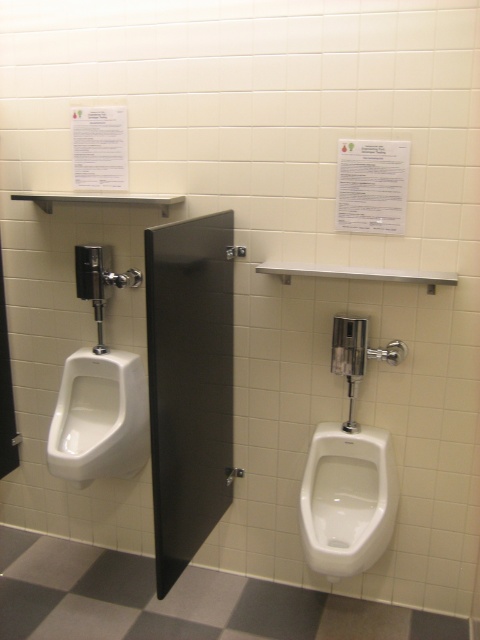
Which is more to the left, white glossy urinal at lower right or white glossy urinal at left?

From the viewer's perspective, white glossy urinal at left appears more on the left side.

Who is higher up, white glossy urinal at lower right or white glossy urinal at left?

Positioned higher is white glossy urinal at left.

Does point (357, 509) lie behind point (67, 404)?

No, it is in front of (67, 404).

Where is `white glossy urinal at lower right`? The height and width of the screenshot is (640, 480). white glossy urinal at lower right is located at coordinates (348, 499).